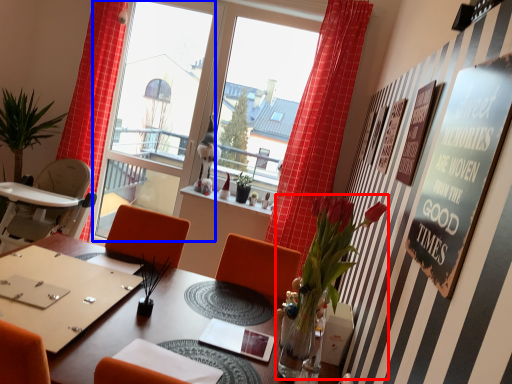
Question: Which object appears farthest to the camera in this image, plant (highlighted by a red box) or window screen (highlighted by a blue box)?

Choices:
 (A) plant
 (B) window screen

Answer: (B)